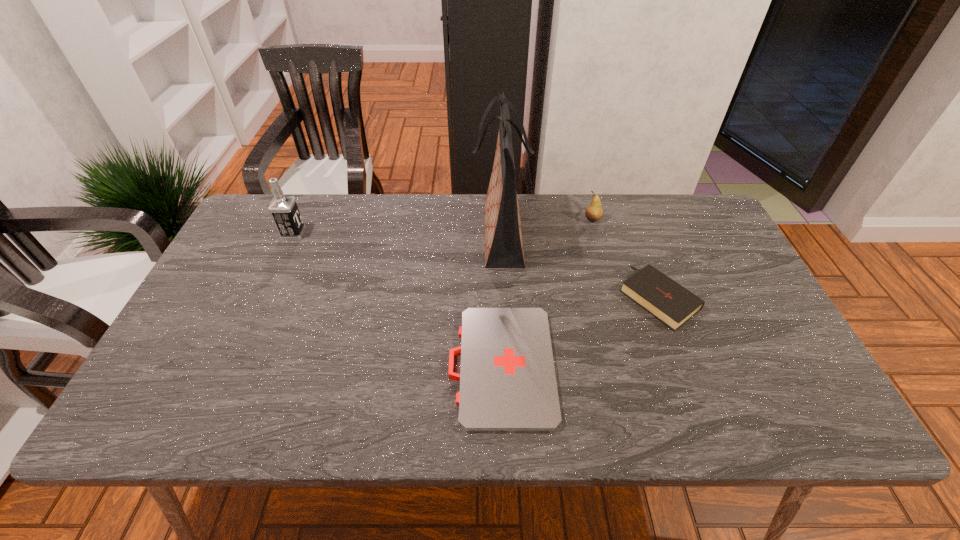
Identify the location of free space located on the left of the third shortest object. (517, 219).

This screenshot has width=960, height=540. In order to click on free point located on the back of the Bible in this screenshot , I will do `click(630, 220)`.

At what (x,y) coordinates should I click in order to perform the action: click on free space located on handle side the shortest object. Please return your answer as a coordinate pair (x, y). This screenshot has height=540, width=960. Looking at the image, I should click on (423, 366).

You are a GUI agent. You are given a task and a screenshot of the screen. Output one action in this format:
    pyautogui.click(x=<x>, y=<y>)
    Task: Click on the vacant area located 0.170m on handle side the shortest object
    This screenshot has width=960, height=540.
    Given the screenshot: What is the action you would take?
    [x=375, y=366]

I want to click on vacant space located 0.280m on handle side the shortest object, so click(327, 366).

What are the coordinates of `shopping bag that is at the far edge` in the screenshot? It's located at (503, 237).

The height and width of the screenshot is (540, 960). Find the location of `vodka positioned at the far edge`. vodka positioned at the far edge is located at coordinates (284, 210).

Locate an element on the screen. This screenshot has width=960, height=540. pear located at the far edge is located at coordinates point(594,212).

This screenshot has height=540, width=960. I want to click on object positioned at the near edge, so click(507, 378).

Locate an element on the screen. object that is at the left edge is located at coordinates (284, 210).